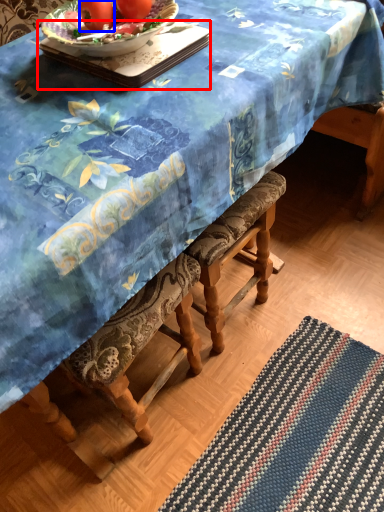
Question: Which object is further to the camera taking this photo, tray (highlighted by a red box) or tomato (highlighted by a blue box)?

Choices:
 (A) tray
 (B) tomato

Answer: (B)